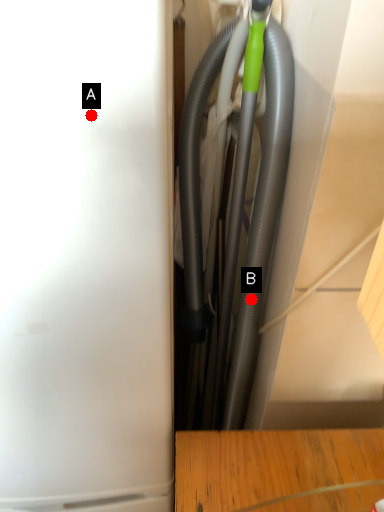
Question: Two points are circled on the image, labeled by A and B beside each circle. Among these points, which one is farthest from the camera?

Choices:
 (A) A is further
 (B) B is further

Answer: (B)